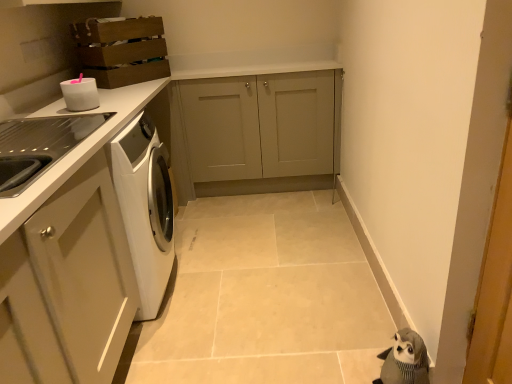
You are a GUI agent. You are given a task and a screenshot of the screen. Output one action in this format:
    pyautogui.click(x=<x>, y=<y>)
    Task: Click on the vacant area that is situated to the right of white glossy container at upper left
    The image size is (512, 384).
    Given the screenshot: What is the action you would take?
    pyautogui.click(x=116, y=105)